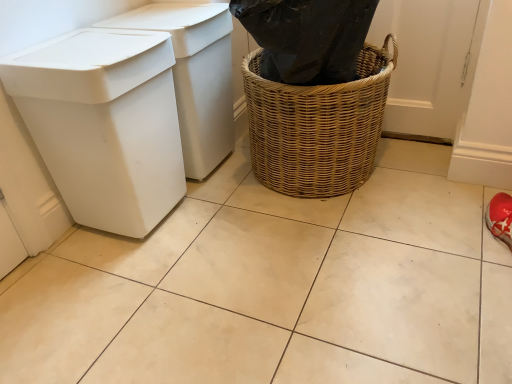
Image resolution: width=512 pixels, height=384 pixels. I want to click on vacant area in front of woven brown basket at center, so click(335, 256).